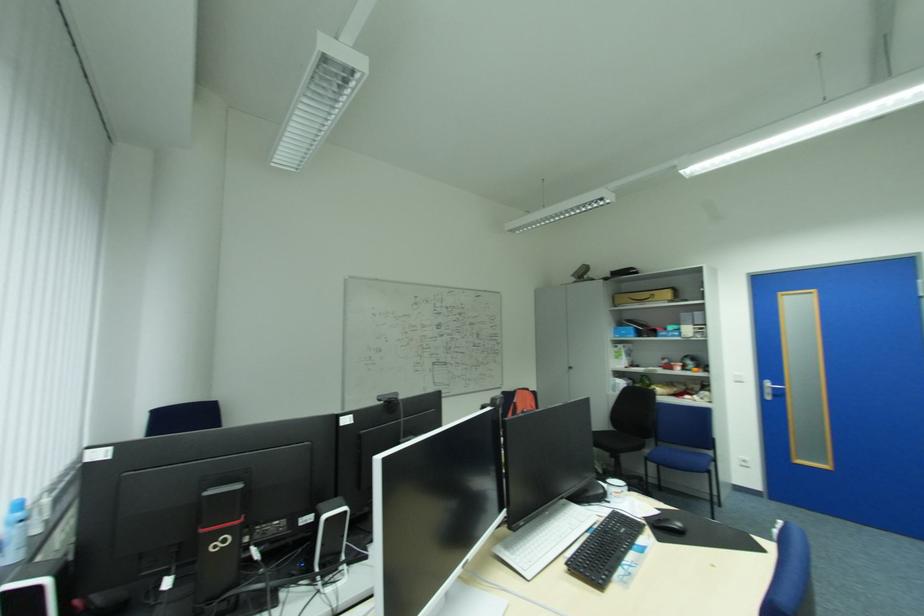
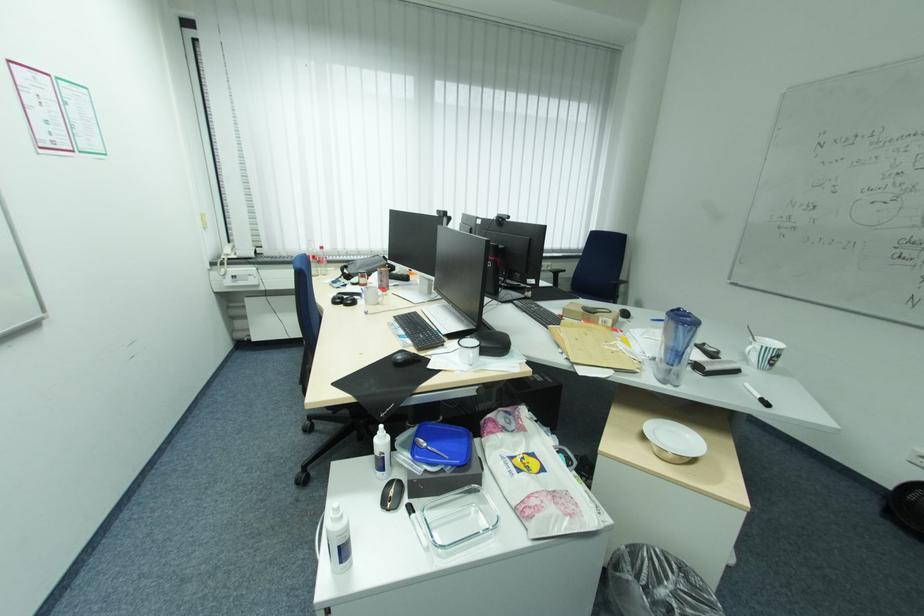
Question: I am providing you with two images of the same scene from different viewpoints. After the viewpoint changes to image2, which objects are now occluded?

Choices:
 (A) blue plastic lid
 (B) chair sitting surface
 (C) telephone handset
 (D) small hammer

Answer: (B)